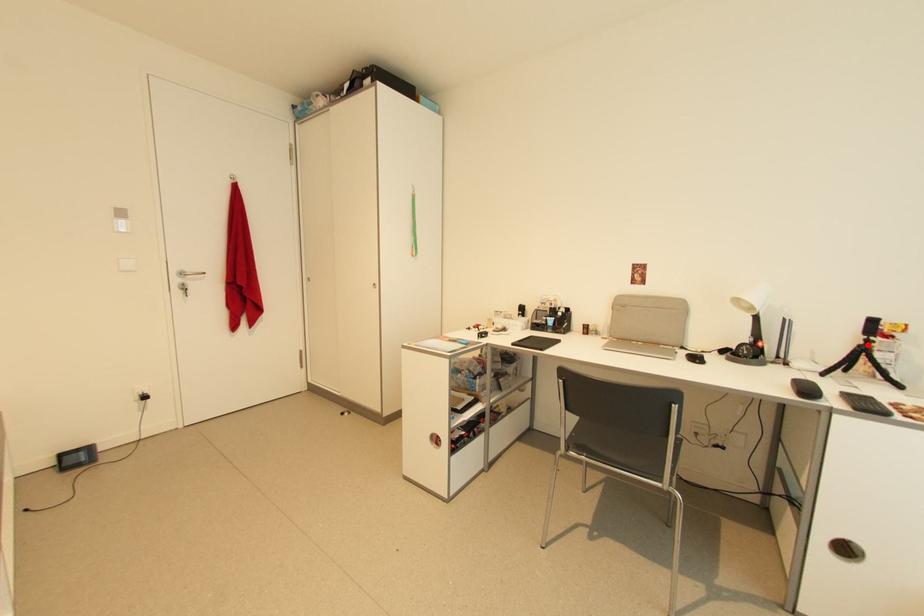
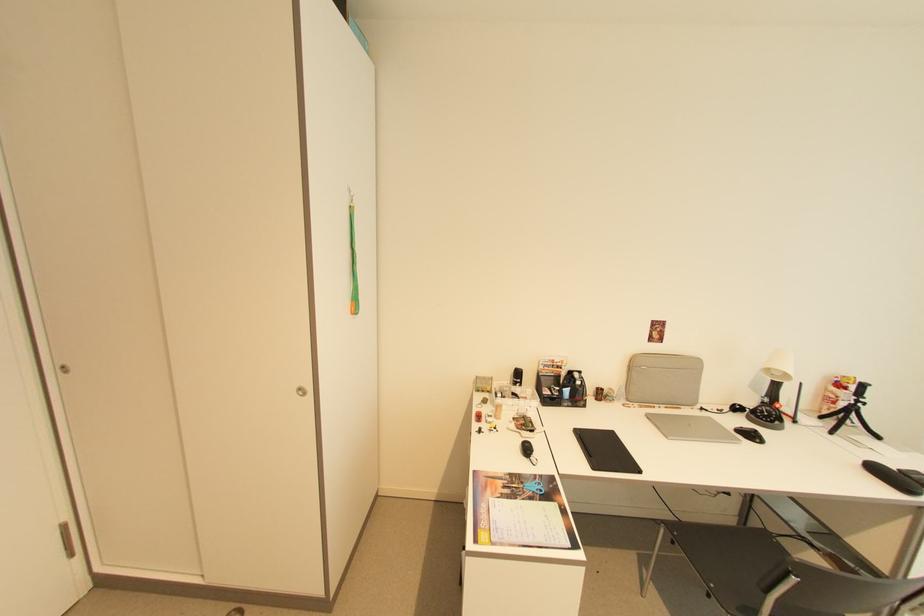
Question: I am providing you with two images of the same scene from different viewpoints. Image1 has a red point marked. In image2, the corresponding 3D location appears at what relative position? Reply with the corresponding letter.

Choices:
 (A) Closer
 (B) Farther

Answer: (A)